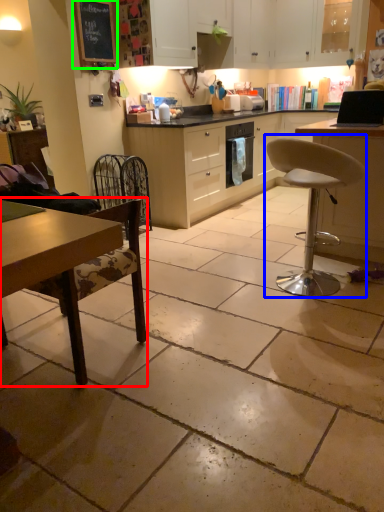
Question: Which is nearer to the chair (highlighted by a red box)? chair (highlighted by a blue box) or bulletin board (highlighted by a green box).

Choices:
 (A) chair
 (B) bulletin board

Answer: (A)